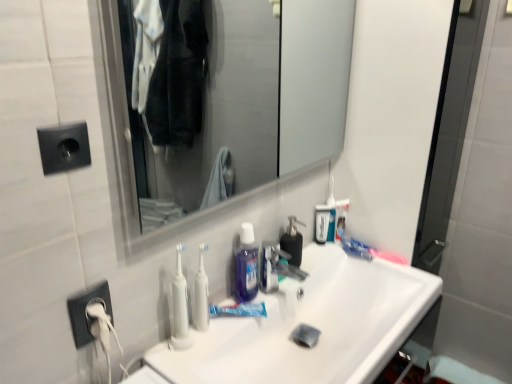
This screenshot has height=384, width=512. What are the coordinates of `vacant area that lies between white plastic toothpaste tube at upper right and black matte soap dispenser at center` in the screenshot? It's located at (321, 254).